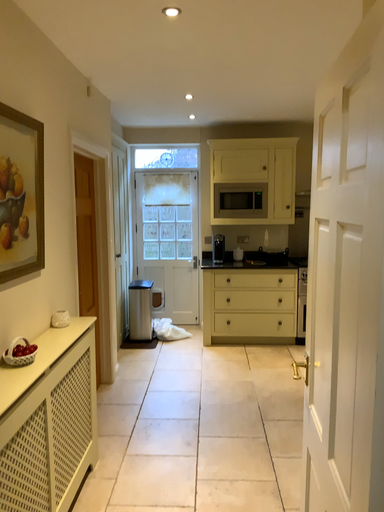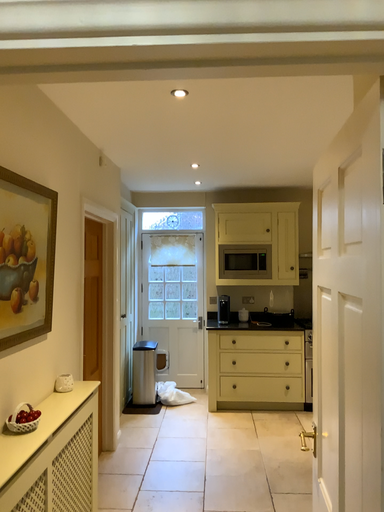
Question: Which way did the camera rotate in the video?

Choices:
 (A) rotated downward
 (B) rotated upward

Answer: (B)